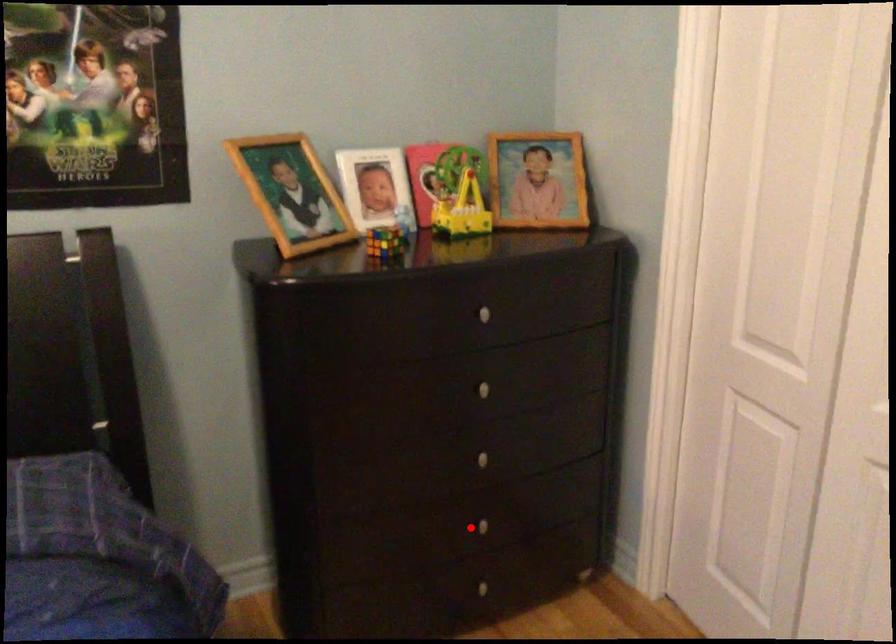
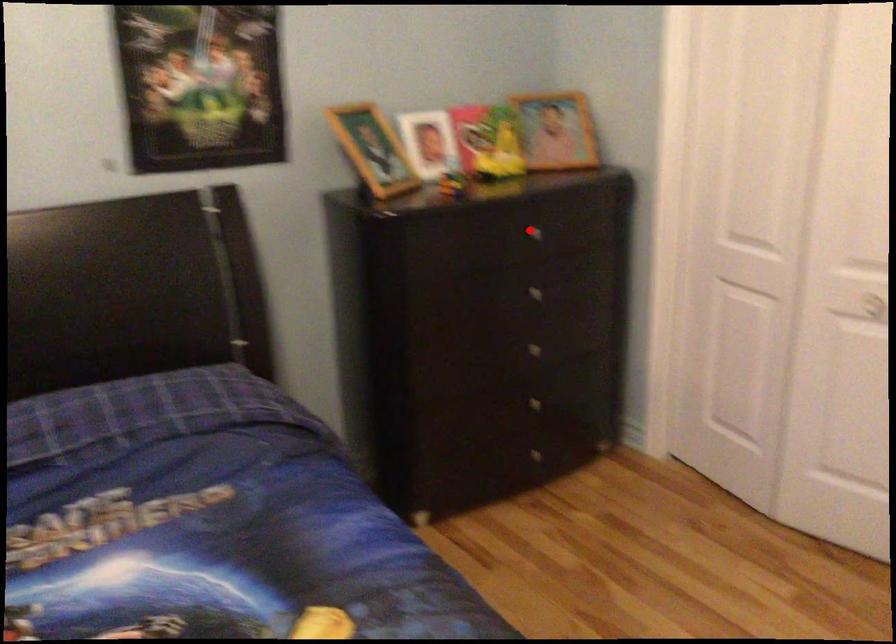
I am providing you with two images of the same scene from different viewpoints. A red point is marked on the first image and another point is marked on the second image. Do the highlighted points in image1 and image2 indicate the same real-world spot?

No